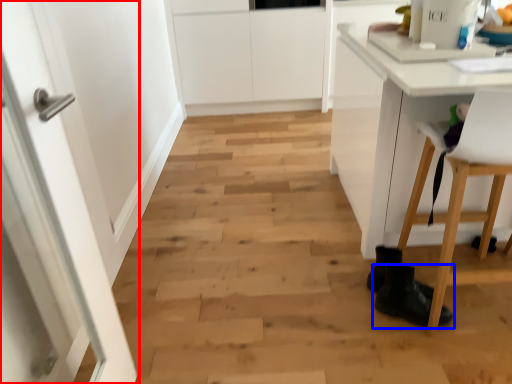
Question: Which object appears closest to the camera in this image, door (highlighted by a red box) or footwear (highlighted by a blue box)?

Choices:
 (A) door
 (B) footwear

Answer: (A)